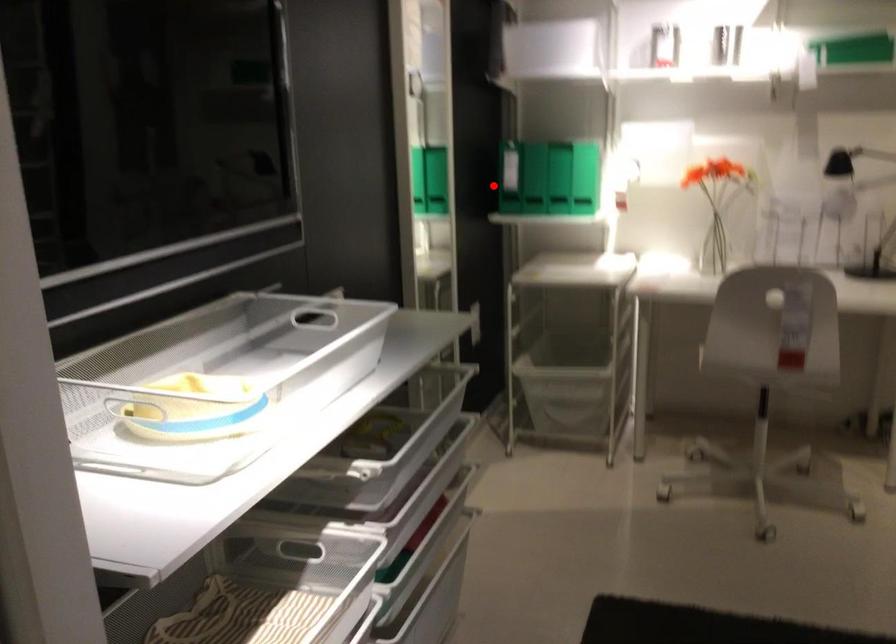
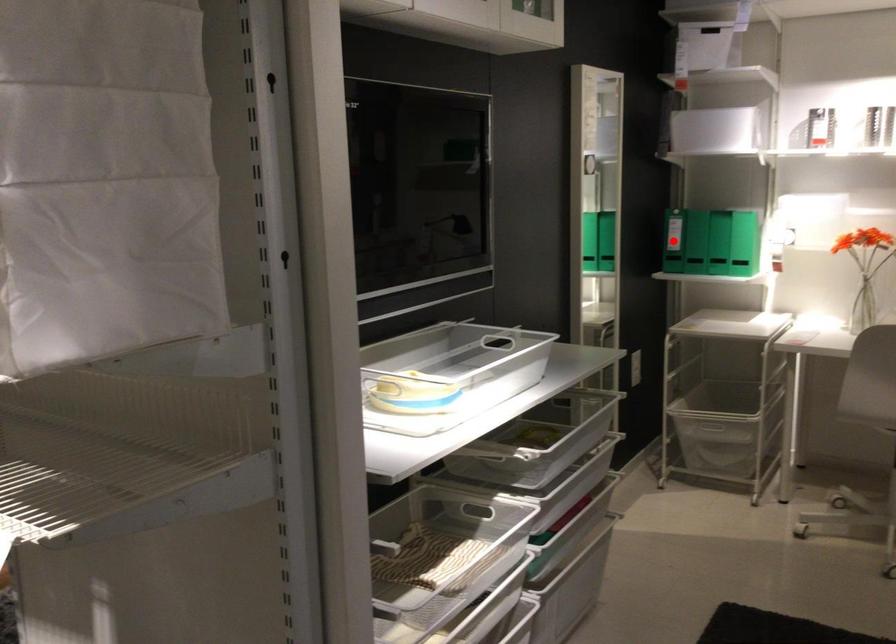
I am providing you with two images of the same scene from different viewpoints. A red point is marked on the first image and another point is marked on the second image. Does the point marked in image1 correspond to the same location as the one in image2?

Yes